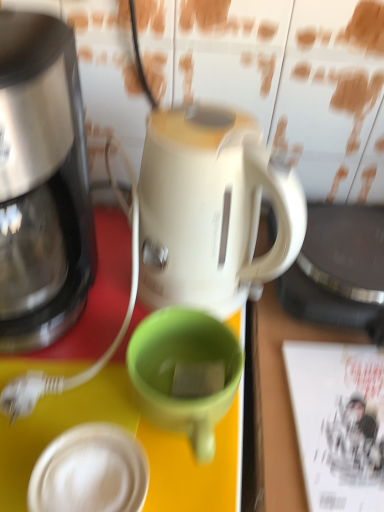
Where is `vacant space underneath white paper magazine at right (from a real-world perspective)`? vacant space underneath white paper magazine at right (from a real-world perspective) is located at coordinates (345, 426).